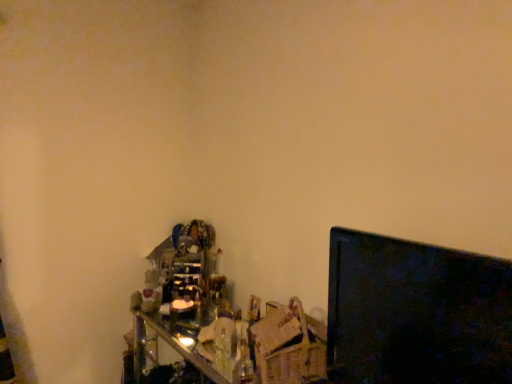
What do you see at coordinates (417, 312) in the screenshot? I see `black glossy monitor at right` at bounding box center [417, 312].

At what (x,y) coordinates should I click in order to perform the action: click on black glossy monitor at right. Please return your answer as a coordinate pair (x, y). Looking at the image, I should click on (417, 312).

At what (x,y) coordinates should I click in order to perform the action: click on black glossy monitor at right. Please return your answer as a coordinate pair (x, y). Looking at the image, I should click on (417, 312).